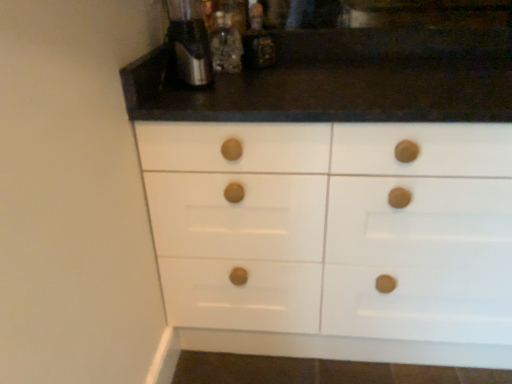
Question: From a real-world perspective, is translucent glass bottle at upper center, the first bottle when ordered from left to right, physically located above or below satin silver coffee machine at upper center?

Choices:
 (A) below
 (B) above

Answer: (A)

Question: Considering the positions of translucent glass bottle at upper center, the first bottle when ordered from left to right, and satin silver coffee machine at upper center in the image, is translucent glass bottle at upper center, the first bottle when ordered from left to right, taller or shorter than satin silver coffee machine at upper center?

Choices:
 (A) short
 (B) tall

Answer: (A)

Question: Which object is the farthest from the satin silver coffee machine at upper center?

Choices:
 (A) translucent glass bottle at upper center, the first bottle when ordered from left to right
 (B) metallic silver bottle at upper center, the first bottle when ordered from right to left

Answer: (B)

Question: Which object is the closest to the metallic silver bottle at upper center, the first bottle when ordered from right to left?

Choices:
 (A) satin silver coffee machine at upper center
 (B) translucent glass bottle at upper center, which is the second bottle from right to left

Answer: (B)